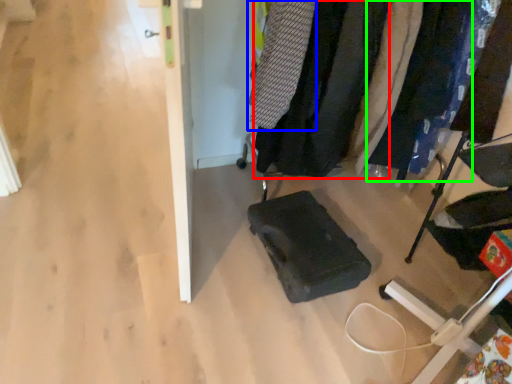
Question: Which object is positioned closest to clothing (highlighted by a red box)? Select from clothing (highlighted by a blue box) and clothing (highlighted by a green box).

Choices:
 (A) clothing
 (B) clothing

Answer: (A)